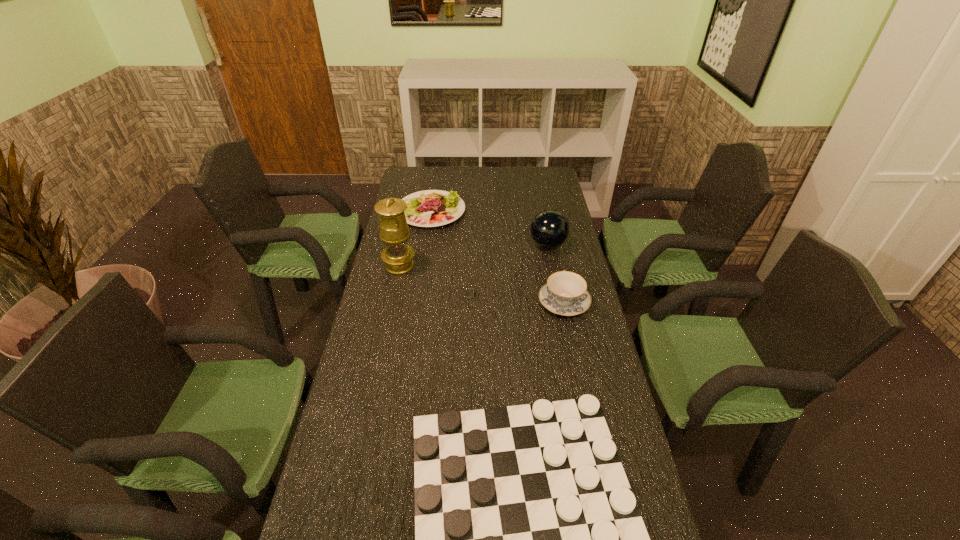
What are the coordinates of `object that is the second closest to the chinaware` in the screenshot? It's located at (469, 293).

Locate an element on the screen. Image resolution: width=960 pixels, height=540 pixels. free region that satisfies the following two spatial constraints: 1. with the handle on the side of the chinaware; 2. on the side of the bowling ball with the finger holes is located at coordinates (552, 245).

I want to click on free location that satisfies the following two spatial constraints: 1. with the handle on the side of the chinaware; 2. on the face of the watch, so click(563, 294).

Find the location of `free space that satisfies the following two spatial constraints: 1. on the face of the watch; 2. with the handle on the side of the third tallest object`. free space that satisfies the following two spatial constraints: 1. on the face of the watch; 2. with the handle on the side of the third tallest object is located at coordinates (469, 302).

Locate an element on the screen. free space that satisfies the following two spatial constraints: 1. on the side of the second tallest object with the finger holes; 2. on the front side of the oil lamp is located at coordinates (552, 265).